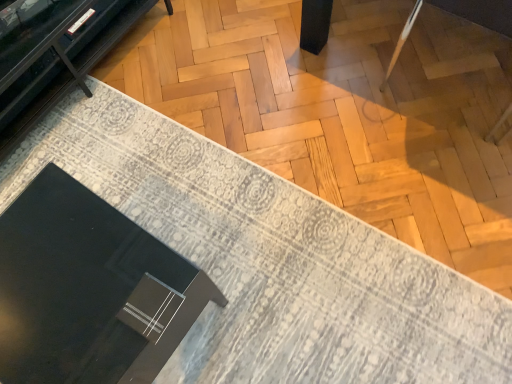
Question: Is matte black box at lower left to the right of matte black tv stand at upper left from the viewer's perspective?

Choices:
 (A) yes
 (B) no

Answer: (A)

Question: Is matte black box at lower left turned away from matte black tv stand at upper left?

Choices:
 (A) no
 (B) yes

Answer: (A)

Question: Does matte black box at lower left contain matte black tv stand at upper left?

Choices:
 (A) no
 (B) yes

Answer: (A)

Question: Does matte black box at lower left have a lesser width compared to matte black tv stand at upper left?

Choices:
 (A) yes
 (B) no

Answer: (B)

Question: Does matte black box at lower left have a smaller size compared to matte black tv stand at upper left?

Choices:
 (A) no
 (B) yes

Answer: (B)

Question: From a real-world perspective, is matte black box at lower left positioned above or below black glossy round table at lower left?

Choices:
 (A) above
 (B) below

Answer: (B)

Question: Would you say matte black box at lower left is to the left or to the right of black glossy round table at lower left in the picture?

Choices:
 (A) right
 (B) left

Answer: (A)

Question: From their relative heights in the image, would you say matte black box at lower left is taller or shorter than black glossy round table at lower left?

Choices:
 (A) tall
 (B) short

Answer: (B)

Question: Relative to black glossy round table at lower left, is matte black box at lower left in front or behind?

Choices:
 (A) behind
 (B) front

Answer: (A)

Question: From a real-world perspective, is black glossy round table at lower left physically located above or below matte black box at lower left?

Choices:
 (A) above
 (B) below

Answer: (A)

Question: In the image, is black glossy round table at lower left positioned in front of or behind matte black box at lower left?

Choices:
 (A) front
 (B) behind

Answer: (A)

Question: Is point (15, 248) closer or farther from the camera than point (418, 135)?

Choices:
 (A) farther
 (B) closer

Answer: (B)

Question: From the image's perspective, relative to matte black box at lower left, is black glossy round table at lower left above or below?

Choices:
 (A) above
 (B) below

Answer: (B)

Question: In the image, is black glossy round table at lower left on the left side or the right side of matte black tv stand at upper left?

Choices:
 (A) left
 (B) right

Answer: (B)

Question: Is point (69, 274) positioned closer to the camera than point (30, 99)?

Choices:
 (A) closer
 (B) farther

Answer: (A)